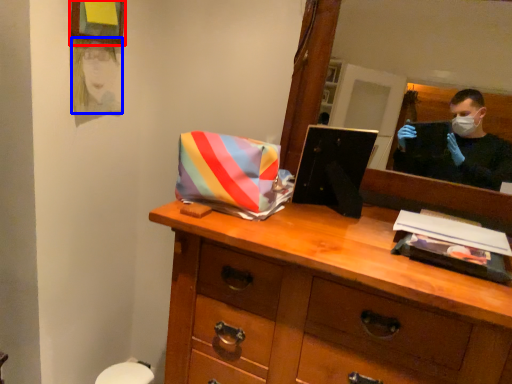
Question: Which object is further to the camera taking this photo, picture frame (highlighted by a red box) or person (highlighted by a blue box)?

Choices:
 (A) picture frame
 (B) person

Answer: (B)